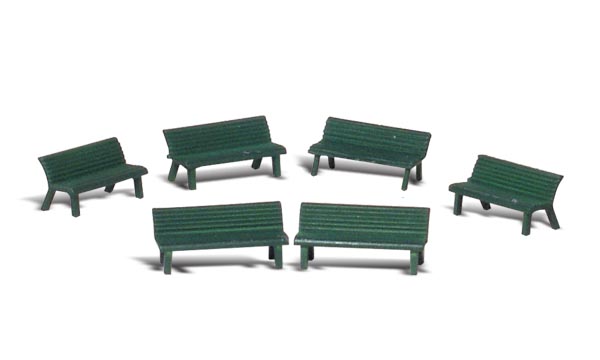
The height and width of the screenshot is (360, 600). I want to click on leg of bench, so click(x=76, y=208).